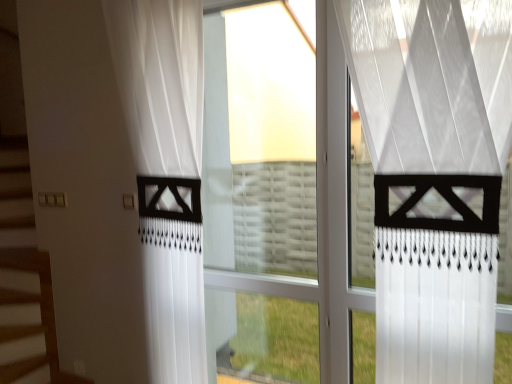
Find the location of a particular element. This screenshot has width=512, height=384. transparent glass window at center is located at coordinates (277, 196).

Where is `white sheer curtain at center, the 1th curtain positioned from the right`? white sheer curtain at center, the 1th curtain positioned from the right is located at coordinates (433, 176).

This screenshot has height=384, width=512. Find the location of `transparent glass window at center`. transparent glass window at center is located at coordinates (277, 196).

Is transparent glass window at center further to camera compared to white sheer curtain at left, placed as the 1th curtain when sorted from left to right?

Yes, the depth of transparent glass window at center is greater than that of white sheer curtain at left, placed as the 1th curtain when sorted from left to right.

Between transparent glass window at center and white sheer curtain at left, which is the second curtain in right-to-left order, which one has more height?

With more height is transparent glass window at center.

Based on the photo, can you confirm if transparent glass window at center is thinner than white sheer curtain at left, the 1th curtain viewed from the back?

Correct, the width of transparent glass window at center is less than that of white sheer curtain at left, the 1th curtain viewed from the back.

Is transparent glass window at center situated inside white sheer curtain at left, which is the second curtain in right-to-left order, or outside?

transparent glass window at center is not inside white sheer curtain at left, which is the second curtain in right-to-left order, it's outside.

Does point (457, 305) come farther from viewer compared to point (336, 98)?

No, (457, 305) is closer to viewer.

From the image's perspective, would you say white sheer curtain at center, placed as the 2th curtain when sorted from left to right, is shown under transparent glass window at center?

No, from the image's perspective, white sheer curtain at center, placed as the 2th curtain when sorted from left to right, is not below transparent glass window at center.

Based on their sizes in the image, would you say white sheer curtain at center, placed as the 2th curtain when sorted from left to right, is bigger or smaller than transparent glass window at center?

Clearly, white sheer curtain at center, placed as the 2th curtain when sorted from left to right, is larger in size than transparent glass window at center.

Which of these two, white sheer curtain at left, placed as the 1th curtain when sorted from left to right, or white sheer curtain at center, placed as the 2th curtain when sorted from left to right, stands taller?

white sheer curtain at left, placed as the 1th curtain when sorted from left to right, is taller.

Which is behind, white sheer curtain at left, which is the second curtain in right-to-left order, or white sheer curtain at center, placed as the 2th curtain when sorted from left to right?

white sheer curtain at left, which is the second curtain in right-to-left order.

Is white sheer curtain at left, placed as the 1th curtain when sorted from left to right, directly adjacent to white sheer curtain at center, the 2th curtain positioned from the back?

No, white sheer curtain at left, placed as the 1th curtain when sorted from left to right, is not beside white sheer curtain at center, the 2th curtain positioned from the back.

Which of these two, white sheer curtain at left, the 2th curtain viewed from the front, or white sheer curtain at center, the 2th curtain positioned from the back, is thinner?

With smaller width is white sheer curtain at center, the 2th curtain positioned from the back.

From the image's perspective, relative to transparent glass window at center, is white sheer curtain at left, the 1th curtain viewed from the back, above or below?

From the image's perspective, white sheer curtain at left, the 1th curtain viewed from the back, appears above transparent glass window at center.

Measure the distance from white sheer curtain at left, the 1th curtain viewed from the back, to transparent glass window at center.

A distance of 22.31 inches exists between white sheer curtain at left, the 1th curtain viewed from the back, and transparent glass window at center.

Considering the positions of points (169, 338) and (337, 68), is point (169, 338) closer to camera compared to point (337, 68)?

No, it is behind (337, 68).

Does white sheer curtain at left, the 2th curtain viewed from the front, appear on the left side of transparent glass window at center?

Correct, you'll find white sheer curtain at left, the 2th curtain viewed from the front, to the left of transparent glass window at center.

Is transparent glass window at center oriented towards white sheer curtain at center, placed as the 2th curtain when sorted from left to right?

No, transparent glass window at center is not turned towards white sheer curtain at center, placed as the 2th curtain when sorted from left to right.

Considering the relative sizes of transparent glass window at center and white sheer curtain at center, placed as the 2th curtain when sorted from left to right, in the image provided, is transparent glass window at center taller than white sheer curtain at center, placed as the 2th curtain when sorted from left to right,?

Yes, transparent glass window at center is taller than white sheer curtain at center, placed as the 2th curtain when sorted from left to right.

Which object is wider, transparent glass window at center or white sheer curtain at center, the 2th curtain positioned from the back?

With larger width is white sheer curtain at center, the 2th curtain positioned from the back.

Could you tell me if white sheer curtain at center, the 1th curtain positioned from the right, is facing white sheer curtain at left, the 1th curtain viewed from the back?

No.

Where is `curtain below the white sheer curtain at center, which is the first curtain from front to back (from the image's perspective)`? The image size is (512, 384). curtain below the white sheer curtain at center, which is the first curtain from front to back (from the image's perspective) is located at coordinates (160, 81).

Looking at this image, which object is further away from the camera, white sheer curtain at center, placed as the 2th curtain when sorted from left to right, or white sheer curtain at left, placed as the 1th curtain when sorted from left to right?

white sheer curtain at left, placed as the 1th curtain when sorted from left to right, is further from the camera.

Can you see white sheer curtain at center, the 1th curtain positioned from the right, touching white sheer curtain at left, the 2th curtain viewed from the front?

white sheer curtain at center, the 1th curtain positioned from the right, and white sheer curtain at left, the 2th curtain viewed from the front, are not in contact.

This screenshot has width=512, height=384. In order to click on glass window that is on the right side of white sheer curtain at left, which is the second curtain in right-to-left order in this screenshot , I will do `click(277, 196)`.

At what (x,y) coordinates should I click in order to perform the action: click on the 2nd curtain above the transparent glass window at center (from the image's perspective). Please return your answer as a coordinate pair (x, y). Looking at the image, I should click on 433,176.

Looking at the image, which one is located closer to transparent glass window at center, white sheer curtain at left, which is the second curtain in right-to-left order, or white sheer curtain at center, placed as the 2th curtain when sorted from left to right?

white sheer curtain at left, which is the second curtain in right-to-left order.

Considering their positions, is white sheer curtain at left, which is the second curtain in right-to-left order, positioned closer to white sheer curtain at center, which is the first curtain from front to back, than transparent glass window at center?

transparent glass window at center.

Based on their spatial positions, is transparent glass window at center or white sheer curtain at left, which is the second curtain in right-to-left order, further from white sheer curtain at center, the 1th curtain positioned from the right?

white sheer curtain at left, which is the second curtain in right-to-left order.

Which object lies further to the anchor point white sheer curtain at left, placed as the 1th curtain when sorted from left to right, white sheer curtain at center, placed as the 2th curtain when sorted from left to right, or transparent glass window at center?

Based on the image, white sheer curtain at center, placed as the 2th curtain when sorted from left to right, appears to be further to white sheer curtain at left, placed as the 1th curtain when sorted from left to right.

Based on their spatial positions, is white sheer curtain at center, the 1th curtain positioned from the right, or white sheer curtain at left, the 1th curtain viewed from the back, further from transparent glass window at center?

white sheer curtain at center, the 1th curtain positioned from the right, lies further to transparent glass window at center than the other object.

Consider the image. Based on their spatial positions, is transparent glass window at center or white sheer curtain at center, the 1th curtain positioned from the right, closer to white sheer curtain at left, placed as the 1th curtain when sorted from left to right?

transparent glass window at center lies closer to white sheer curtain at left, placed as the 1th curtain when sorted from left to right, than the other object.

At what (x,y) coordinates should I click in order to perform the action: click on glass window between white sheer curtain at left, the 1th curtain viewed from the back, and white sheer curtain at center, the 1th curtain positioned from the right, from left to right. Please return your answer as a coordinate pair (x, y). Image resolution: width=512 pixels, height=384 pixels. Looking at the image, I should click on (277, 196).